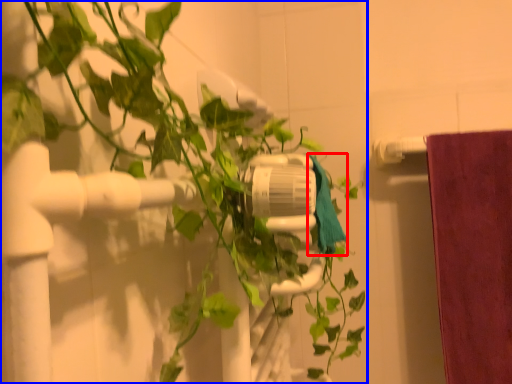
Question: Which point is further to the camera, bath towel (highlighted by a red box) or houseplant (highlighted by a blue box)?

Choices:
 (A) bath towel
 (B) houseplant

Answer: (A)